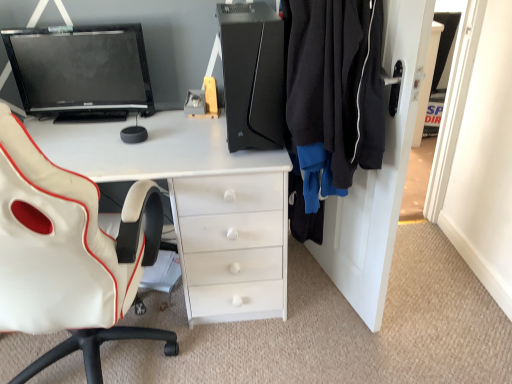
Where is `unoccupied region to the right of matte black monitor at upper left`? This screenshot has width=512, height=384. unoccupied region to the right of matte black monitor at upper left is located at coordinates (159, 124).